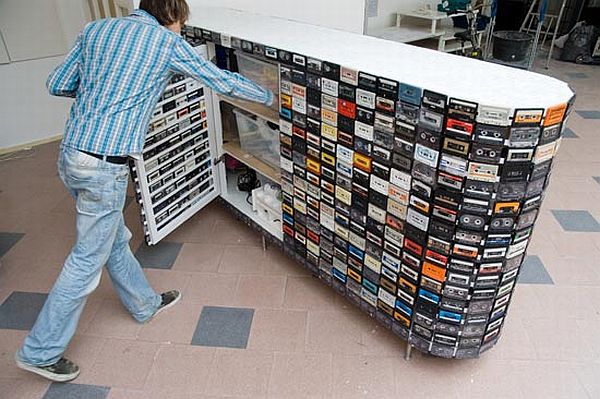
I want to click on grey tile, so click(225, 328).